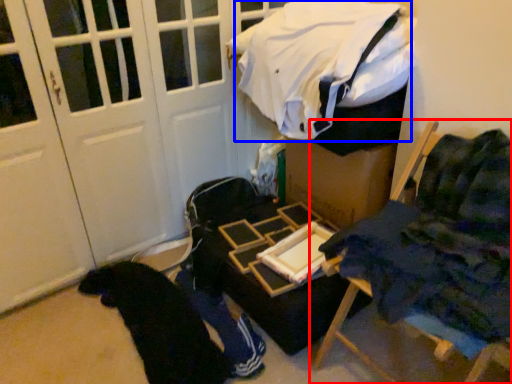
Question: Which object appears closest to the camera in this image, furniture (highlighted by a red box) or laundry (highlighted by a blue box)?

Choices:
 (A) furniture
 (B) laundry

Answer: (A)